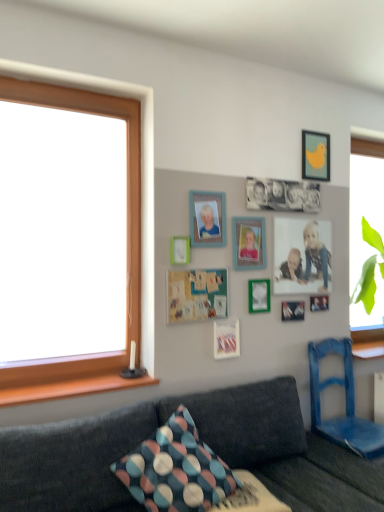
Question: From the image's perspective, is matte plastic photo frame at upper center, arranged as the 5th picture frame when viewed from the right, located above or below matte wooden frame at lower right, which is the fourth decorative picture from left to right?

Choices:
 (A) below
 (B) above

Answer: (B)

Question: Is matte plastic photo frame at upper center, the second picture frame positioned from the left, in front of or behind matte wooden frame at lower right, placed as the 3th decorative picture when sorted from bottom to top, in the image?

Choices:
 (A) front
 (B) behind

Answer: (A)

Question: Estimate the real-world distances between objects in this image. Which object is farther from the matte paper photo frame at center, arranged as the 4th decorative picture when viewed from the right?

Choices:
 (A) green felt bulletin board at center
 (B) matte wooden photo frame at center, the second picture frame when ordered from right to left
 (C) blue wooden chair at lower right
 (D) green matte picture frame at center, which is the 3th picture frame from right to left
 (E) matte white picture frame at center, acting as the sixth picture frame starting from the right

Answer: (C)

Question: Which object is the closest to the matte wooden photo frame at center, the second picture frame when ordered from right to left?

Choices:
 (A) yellow matte picture frame at upper right, which appears as the sixth picture frame when viewed from the left
 (B) green felt bulletin board at center
 (C) green matte picture frame at center, marked as the fourth picture frame in a left-to-right arrangement
 (D) black matte photograph at center, the third decorative picture positioned from the right
 (E) patterned fabric pillow at center

Answer: (D)